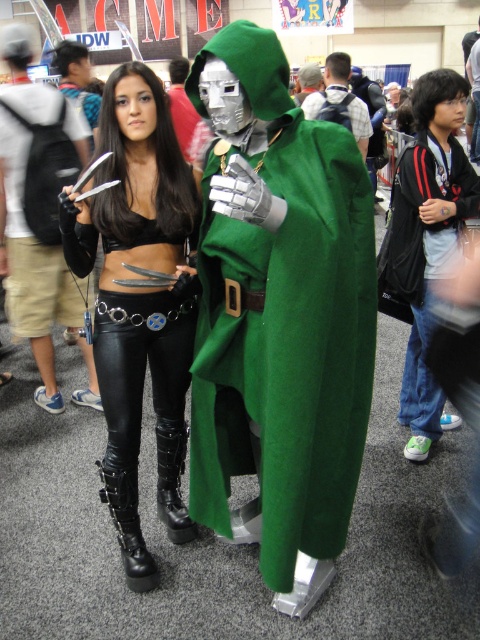
Question: Is green woolen cloak at center behind black leather pants at center?

Choices:
 (A) yes
 (B) no

Answer: (B)

Question: Does green woolen cloak at center appear on the left side of black leather pants at center?

Choices:
 (A) yes
 (B) no

Answer: (B)

Question: Which point is closer to the camera?

Choices:
 (A) green woolen cloak at center
 (B) black leather pants at center

Answer: (A)

Question: Is green woolen cloak at center above black leather pants at center?

Choices:
 (A) no
 (B) yes

Answer: (A)